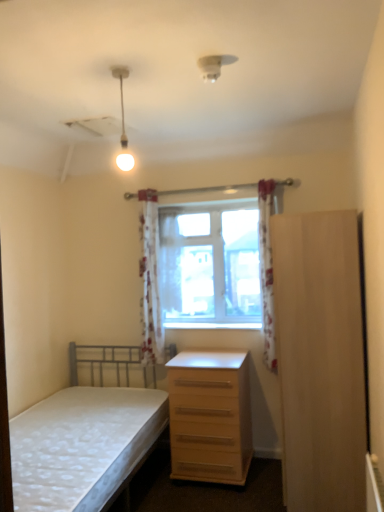
Where is `free space on the front side of light wood/wooden chest of drawers at lower right`? This screenshot has width=384, height=512. free space on the front side of light wood/wooden chest of drawers at lower right is located at coordinates 216,500.